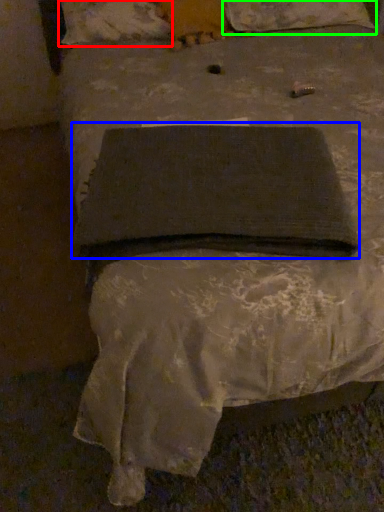
Question: Which object is the farthest from pillow (highlighted by a red box)? Choose among these: pad (highlighted by a blue box) or pillow (highlighted by a green box).

Choices:
 (A) pad
 (B) pillow

Answer: (A)